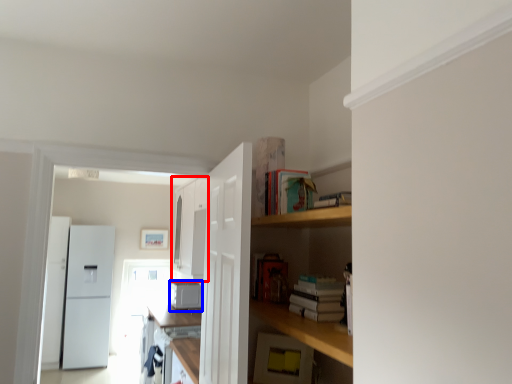
Question: Which of the following is the farthest to the observer, cabinetry (highlighted by a red box) or appliance (highlighted by a blue box)?

Choices:
 (A) cabinetry
 (B) appliance

Answer: (B)